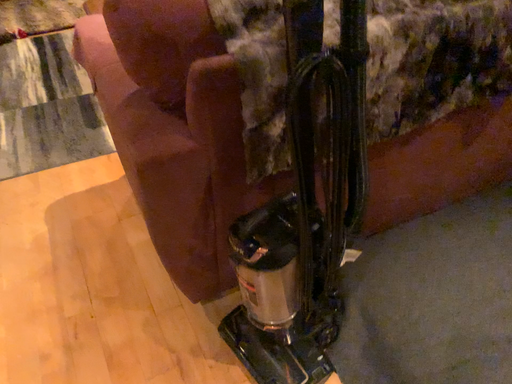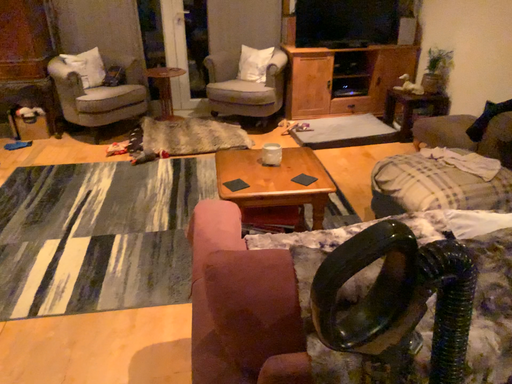
Question: How did the camera likely rotate when shooting the video?

Choices:
 (A) rotated downward
 (B) rotated upward

Answer: (B)